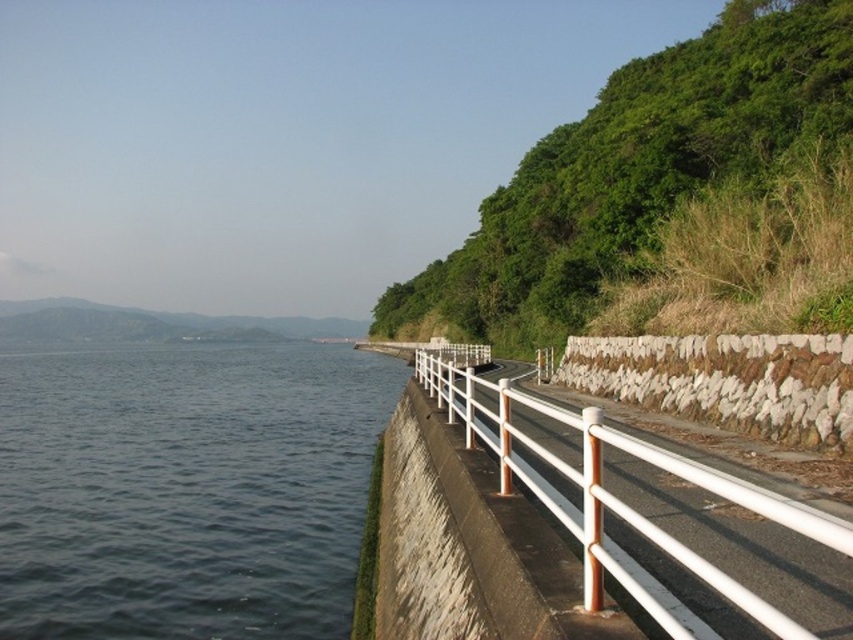
You are a photographer standing on the road and want to capture both the dark blue water at left and the white glossy rail at right in your shot. Which object will appear closer to the bottom of your photo frame?

The dark blue water at left will appear closer to the bottom of the photo frame because it is shorter than the white glossy rail at right.

You are a hiker standing on the road and want to take a photo of both the green leafy hillside at upper right and the white glossy rail at right. Which object should you position closer to the camera to include both in your shot?

To include both the green leafy hillside at upper right and the white glossy rail at right in your photo, you should position the white glossy rail at right closer to the camera since it is behind the green leafy hillside at upper right.

You are a photographer planning to capture a landscape shot of the dark blue water at left and the green leafy hillside at upper right. Based on the scene, which of these two elements occupies a larger portion of the image?

The dark blue water at left might be wider than green leafy hillside at upper right, so it could occupy a larger portion of the image.